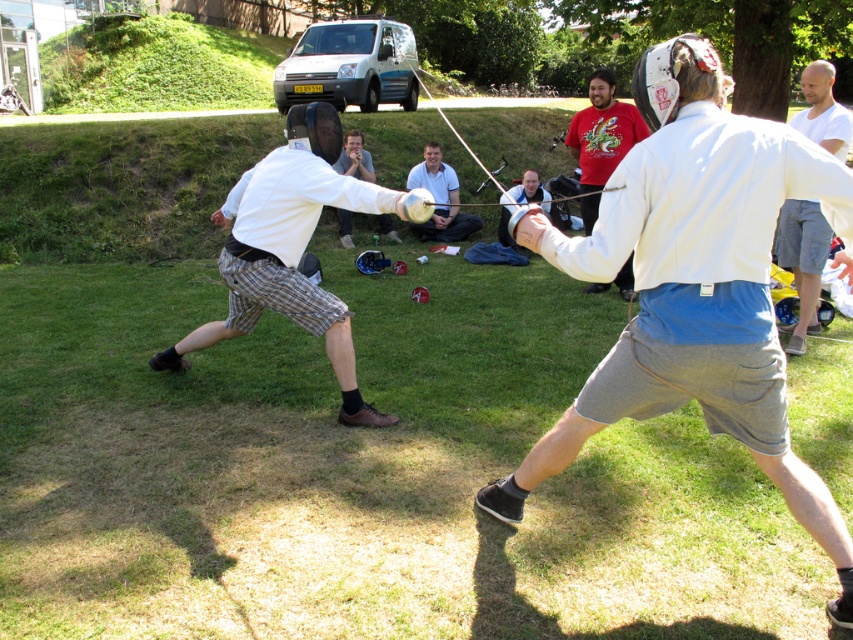
Question: Does white cotton shirt at upper right appear on the right side of red dragon shirt at center?

Choices:
 (A) yes
 (B) no

Answer: (A)

Question: Does red dragon shirt at center appear on the right side of matte silver helmet at center?

Choices:
 (A) yes
 (B) no

Answer: (A)

Question: Which object is positioned farthest from the red dragon shirt at center?

Choices:
 (A) white matte fencing mask at center
 (B) white cotton shirt at upper right
 (C) white matte helmet at center
 (D) matte white helmet at center

Answer: (A)

Question: Which point is farther to the camera?

Choices:
 (A) (811, 115)
 (B) (820, 504)
 (C) (276, 260)

Answer: (A)

Question: Considering the relative positions of white matte helmet at center and matte silver helmet at center in the image provided, where is white matte helmet at center located with respect to matte silver helmet at center?

Choices:
 (A) above
 (B) below

Answer: (B)

Question: Which of the following is the closest to the observer?

Choices:
 (A) (518, 189)
 (B) (410, 221)
 (C) (294, 125)
 (D) (602, 120)

Answer: (C)